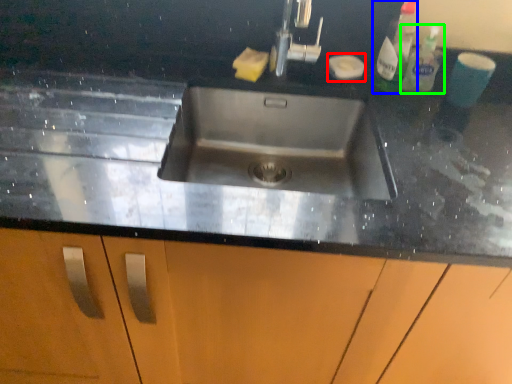
Question: Estimate the real-world distances between objects in this image. Which object is closer to soap (highlighted by a red box), cleaning product (highlighted by a blue box) or cleaning product (highlighted by a green box)?

Choices:
 (A) cleaning product
 (B) cleaning product

Answer: (A)